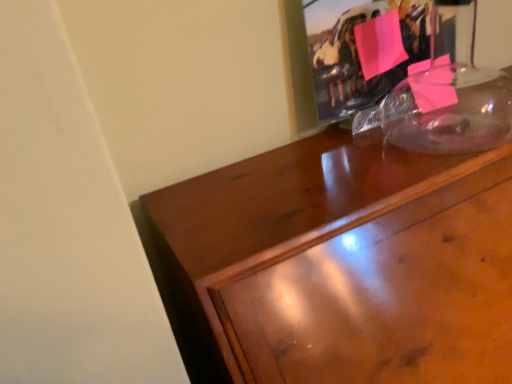
Identify the location of glossy wood desk at upper right. This screenshot has height=384, width=512. pos(262,222).

This screenshot has width=512, height=384. Describe the element at coordinates (262, 222) in the screenshot. I see `glossy wood desk at upper right` at that location.

Measure the distance between glossy wood desk at upper right and camera.

The distance of glossy wood desk at upper right from camera is 13.90 inches.

What do you see at coordinates (297, 71) in the screenshot? I see `pink paper at upper center` at bounding box center [297, 71].

Looking at this image, in order to face pink paper at upper center, should I rotate leftwards or rightwards?

Rotate right and turn 16.122 degrees.

Image resolution: width=512 pixels, height=384 pixels. What are the coordinates of `pink paper at upper center` in the screenshot? It's located at (297, 71).

Find the location of a particular element. This screenshot has height=384, width=512. glossy wood desk at upper right is located at coordinates (262, 222).

Is glossy wood desk at upper right at the right side of pink paper at upper center?

Indeed, glossy wood desk at upper right is positioned on the right side of pink paper at upper center.

Which is in front, glossy wood desk at upper right or pink paper at upper center?

glossy wood desk at upper right is in front.

Considering the points (276, 196) and (494, 62), which point is in front, point (276, 196) or point (494, 62)?

Positioned in front is point (276, 196).

From the image's perspective, does glossy wood desk at upper right appear lower than pink paper at upper center?

Indeed, from the image's perspective, glossy wood desk at upper right is shown beneath pink paper at upper center.

From a real-world perspective, relative to pink paper at upper center, is glossy wood desk at upper right vertically above or below?

glossy wood desk at upper right is below pink paper at upper center.

Which object is thinner, glossy wood desk at upper right or pink paper at upper center?

Thinner between the two is pink paper at upper center.

Is glossy wood desk at upper right shorter than pink paper at upper center?

Incorrect, the height of glossy wood desk at upper right does not fall short of that of pink paper at upper center.

Considering the sizes of objects glossy wood desk at upper right and pink paper at upper center in the image provided, who is smaller, glossy wood desk at upper right or pink paper at upper center?

With smaller size is pink paper at upper center.

Is glossy wood desk at upper right inside the boundaries of pink paper at upper center, or outside?

glossy wood desk at upper right is not inside pink paper at upper center, it's outside.

Would you consider glossy wood desk at upper right to be distant from pink paper at upper center?

That's not correct — glossy wood desk at upper right is a little close to pink paper at upper center.

Is pink paper at upper center at the back of glossy wood desk at upper right?

That's not correct — glossy wood desk at upper right is not looking away from pink paper at upper center.

The image size is (512, 384). What are the coordinates of `desk on the right of the pink paper at upper center` in the screenshot? It's located at (262, 222).

Considering the relative positions of pink paper at upper center and glossy wood desk at upper right in the image provided, is pink paper at upper center to the right of glossy wood desk at upper right from the viewer's perspective?

No, pink paper at upper center is not to the right of glossy wood desk at upper right.

Does pink paper at upper center come in front of glossy wood desk at upper right?

No, it is not.

Between point (489, 0) and point (328, 202), which one is positioned behind?

Point (489, 0)

From the image's perspective, who appears lower, pink paper at upper center or glossy wood desk at upper right?

glossy wood desk at upper right appears lower in the image.

From a real-world perspective, is pink paper at upper center physically above glossy wood desk at upper right?

Yes, from a real-world perspective, pink paper at upper center is over glossy wood desk at upper right

Consider the image. Is pink paper at upper center wider or thinner than glossy wood desk at upper right?

pink paper at upper center is thinner than glossy wood desk at upper right.

Who is taller, pink paper at upper center or glossy wood desk at upper right?

With more height is glossy wood desk at upper right.

Between pink paper at upper center and glossy wood desk at upper right, which one has smaller size?

pink paper at upper center.

Do you think pink paper at upper center is within glossy wood desk at upper right, or outside of it?

pink paper at upper center exists outside the volume of glossy wood desk at upper right.

Are pink paper at upper center and glossy wood desk at upper right far apart?

They are positioned close to each other.

Is pink paper at upper center turned away from glossy wood desk at upper right?

pink paper at upper center is not turned away from glossy wood desk at upper right.

How many degrees apart are the facing directions of pink paper at upper center and glossy wood desk at upper right?

They differ by 3.35 degrees in their facing directions.

How far apart are pink paper at upper center and glossy wood desk at upper right?

The distance of pink paper at upper center from glossy wood desk at upper right is 7.84 inches.

Find the location of a particular element. The height and width of the screenshot is (384, 512). desk on the right of pink paper at upper center is located at coordinates (262, 222).

Identify the location of desk on the right of pink paper at upper center. (262, 222).

This screenshot has height=384, width=512. Identify the location of picture frame on the left of glossy wood desk at upper right. (297, 71).